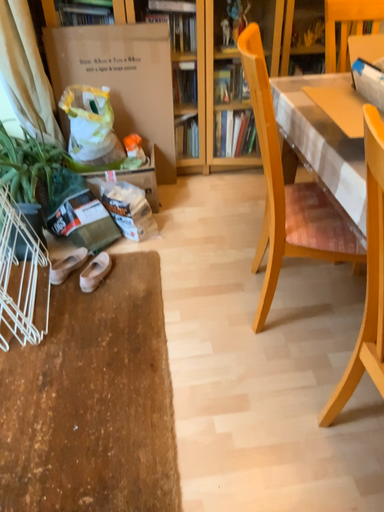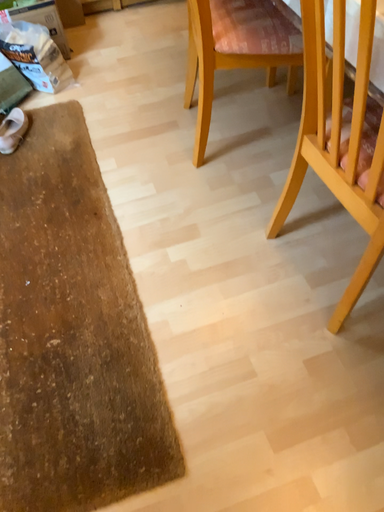
Question: Which way did the camera rotate in the video?

Choices:
 (A) rotated left
 (B) rotated right

Answer: (B)